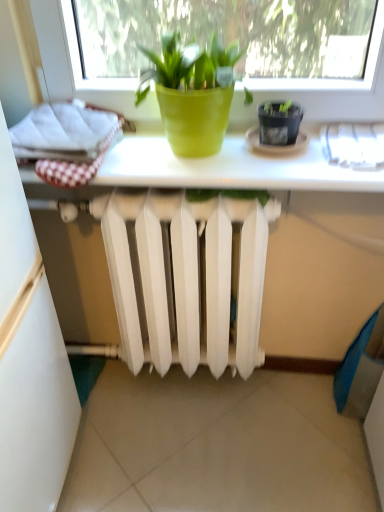
Identify the location of black plastic flowerpot at upper right. (279, 123).

Measure the distance between black plastic flowerpot at upper right and camera.

black plastic flowerpot at upper right is 34.45 inches from camera.

What do you see at coordinates (279, 123) in the screenshot? I see `black plastic flowerpot at upper right` at bounding box center [279, 123].

You are a GUI agent. You are given a task and a screenshot of the screen. Output one action in this format:
    pyautogui.click(x=<x>, y=<y>)
    Task: Click on the green matte pot at center
    The height and width of the screenshot is (512, 384).
    Given the screenshot: What is the action you would take?
    pyautogui.click(x=192, y=92)

The height and width of the screenshot is (512, 384). What do you see at coordinates (192, 92) in the screenshot?
I see `green matte pot at center` at bounding box center [192, 92].

What is the approximate width of green matte pot at center?

7.50 inches.

Identify the location of black plastic flowerpot at upper right. The height and width of the screenshot is (512, 384). (279, 123).

Is black plastic flowerpot at upper right to the left of green matte pot at center from the viewer's perspective?

Incorrect, black plastic flowerpot at upper right is not on the left side of green matte pot at center.

Which object is further away from the camera, black plastic flowerpot at upper right or green matte pot at center?

black plastic flowerpot at upper right is further away from the camera.

Considering the points (269, 130) and (213, 108), which point is behind, point (269, 130) or point (213, 108)?

The point (269, 130) is behind.

From the image's perspective, is black plastic flowerpot at upper right above or below green matte pot at center?

black plastic flowerpot at upper right is below green matte pot at center.

From a real-world perspective, is black plastic flowerpot at upper right located beneath green matte pot at center?

Yes, from a real-world perspective, black plastic flowerpot at upper right is beneath green matte pot at center.

Which of these two, black plastic flowerpot at upper right or green matte pot at center, is thinner?

With smaller width is black plastic flowerpot at upper right.

Is black plastic flowerpot at upper right taller than green matte pot at center?

No, black plastic flowerpot at upper right is not taller than green matte pot at center.

Is black plastic flowerpot at upper right bigger than green matte pot at center?

Incorrect, black plastic flowerpot at upper right is not larger than green matte pot at center.

Would you say green matte pot at center is part of black plastic flowerpot at upper right's contents?

No, green matte pot at center is not a part of black plastic flowerpot at upper right.

Is there a large distance between black plastic flowerpot at upper right and green matte pot at center?

No, there isn't a large distance between black plastic flowerpot at upper right and green matte pot at center.

Could you tell me if black plastic flowerpot at upper right is facing green matte pot at center?

No, black plastic flowerpot at upper right is not oriented towards green matte pot at center.

What's the angular difference between black plastic flowerpot at upper right and green matte pot at center's facing directions?

black plastic flowerpot at upper right and green matte pot at center are facing 0.00028 degrees away from each other.

This screenshot has height=512, width=384. In order to click on houseplant lying in front of the black plastic flowerpot at upper right in this screenshot , I will do `click(192, 92)`.

In the scene shown: Which is more to the right, green matte pot at center or black plastic flowerpot at upper right?

black plastic flowerpot at upper right is more to the right.

Considering the positions of objects green matte pot at center and black plastic flowerpot at upper right in the image provided, who is in front, green matte pot at center or black plastic flowerpot at upper right?

green matte pot at center is in front.

Does point (169, 105) lie in front of point (280, 109)?

Yes, it is.

From the image's perspective, is green matte pot at center below black plastic flowerpot at upper right?

No.

From a real-world perspective, which object stands above the other?

From a 3D spatial view, green matte pot at center is above.

Is green matte pot at center thinner than black plastic flowerpot at upper right?

Incorrect, the width of green matte pot at center is not less than that of black plastic flowerpot at upper right.

Considering the sizes of green matte pot at center and black plastic flowerpot at upper right in the image, is green matte pot at center taller or shorter than black plastic flowerpot at upper right?

green matte pot at center is taller than black plastic flowerpot at upper right.

Can you confirm if green matte pot at center is bigger than black plastic flowerpot at upper right?

Indeed, green matte pot at center has a larger size compared to black plastic flowerpot at upper right.

Based on the photo, is green matte pot at center positioned beyond the bounds of black plastic flowerpot at upper right?

Absolutely, green matte pot at center is external to black plastic flowerpot at upper right.

Is green matte pot at center far from black plastic flowerpot at upper right?

No, there isn't a large distance between green matte pot at center and black plastic flowerpot at upper right.

Is green matte pot at center facing towards black plastic flowerpot at upper right?

No, green matte pot at center is not oriented towards black plastic flowerpot at upper right.

In order to click on houseplant above the black plastic flowerpot at upper right (from the image's perspective) in this screenshot , I will do `click(192, 92)`.

Locate an element on the screen. houseplant above the black plastic flowerpot at upper right (from a real-world perspective) is located at coordinates (192, 92).

Locate an element on the screen. The image size is (384, 512). flowerpot below the green matte pot at center (from a real-world perspective) is located at coordinates (279, 123).